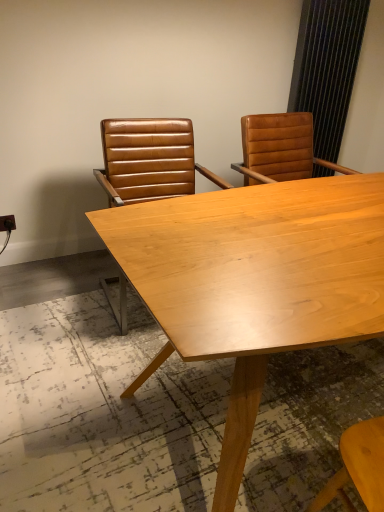
This screenshot has height=512, width=384. What do you see at coordinates (149, 160) in the screenshot? I see `brown leather chair at center, the 1th chair in the left-to-right sequence` at bounding box center [149, 160].

The height and width of the screenshot is (512, 384). Find the location of `brown leather chair at center, the 1th chair in the left-to-right sequence`. brown leather chair at center, the 1th chair in the left-to-right sequence is located at coordinates 149,160.

Which of these two, brown leather chair at center, the second chair when ordered from right to left, or brown leather chair at upper right, arranged as the second chair when viewed from the left, is bigger?

With larger size is brown leather chair at center, the second chair when ordered from right to left.

Is brown leather chair at center, the 1th chair in the left-to-right sequence, surrounding brown leather chair at upper right, arranged as the second chair when viewed from the left?

No, brown leather chair at upper right, arranged as the second chair when viewed from the left, is not surrounded by brown leather chair at center, the 1th chair in the left-to-right sequence.

Is brown leather chair at center, the second chair when ordered from right to left, turned away from brown leather chair at upper right, arranged as the second chair when viewed from the left?

brown leather chair at center, the second chair when ordered from right to left, does not have its back to brown leather chair at upper right, arranged as the second chair when viewed from the left.

I want to click on chair lying on the left of light wood table at center, so click(149, 160).

Is brown leather chair at center, the second chair when ordered from right to left, at the back of light wood table at center?

Yes, light wood table at center is facing away from brown leather chair at center, the second chair when ordered from right to left.

Considering the sizes of objects light wood table at center and brown leather chair at center, the 1th chair in the left-to-right sequence, in the image provided, who is smaller, light wood table at center or brown leather chair at center, the 1th chair in the left-to-right sequence,?

Smaller between the two is brown leather chair at center, the 1th chair in the left-to-right sequence.

Does light wood table at center have a lesser height compared to brown leather chair at center, the 1th chair in the left-to-right sequence?

Yes.

Are black textured curtain at upper right and brown leather chair at center, the second chair when ordered from right to left, located far from each other?

Yes, black textured curtain at upper right is far from brown leather chair at center, the second chair when ordered from right to left.

Which of these two, black textured curtain at upper right or brown leather chair at center, the 1th chair in the left-to-right sequence, is smaller?

With smaller size is black textured curtain at upper right.

Consider the image. Is black textured curtain at upper right thinner than brown leather chair at center, the 1th chair in the left-to-right sequence?

Yes, black textured curtain at upper right is thinner than brown leather chair at center, the 1th chair in the left-to-right sequence.

Is brown leather chair at center, the 1th chair in the left-to-right sequence, at the back of black textured curtain at upper right?

No.

From a real-world perspective, between light wood table at center and brown leather chair at upper right, which appears as the first chair when viewed from the right, who is vertically higher?

brown leather chair at upper right, which appears as the first chair when viewed from the right, from a real-world perspective.

Which of these two, light wood table at center or brown leather chair at upper right, arranged as the second chair when viewed from the left, stands taller?

light wood table at center is taller.

From the image's perspective, who appears lower, light wood table at center or brown leather chair at upper right, which appears as the first chair when viewed from the right?

light wood table at center is shown below in the image.

Can you confirm if light wood table at center is smaller than brown leather chair at upper right, arranged as the second chair when viewed from the left?

No, light wood table at center is not smaller than brown leather chair at upper right, arranged as the second chair when viewed from the left.

Does brown leather chair at upper right, which appears as the first chair when viewed from the right, have a lesser height compared to light wood table at center?

Yes, brown leather chair at upper right, which appears as the first chair when viewed from the right, is shorter than light wood table at center.

Consider the image. Which object is thinner, brown leather chair at upper right, which appears as the first chair when viewed from the right, or light wood table at center?

brown leather chair at upper right, which appears as the first chair when viewed from the right, is thinner.

Is black textured curtain at upper right inside the boundaries of brown leather chair at upper right, which appears as the first chair when viewed from the right, or outside?

black textured curtain at upper right is outside brown leather chair at upper right, which appears as the first chair when viewed from the right.

Is black textured curtain at upper right looking in the opposite direction of brown leather chair at upper right, arranged as the second chair when viewed from the left?

black textured curtain at upper right does not have its back to brown leather chair at upper right, arranged as the second chair when viewed from the left.

From the picture: Is black textured curtain at upper right next to brown leather chair at upper right, arranged as the second chair when viewed from the left, and touching it?

They are not placed beside each other.

From the image's perspective, is black textured curtain at upper right on brown leather chair at upper right, which appears as the first chair when viewed from the right?

Yes, from the image's perspective, black textured curtain at upper right is above brown leather chair at upper right, which appears as the first chair when viewed from the right.

Is brown leather chair at upper right, which appears as the first chair when viewed from the right, turned away from black textured curtain at upper right?

brown leather chair at upper right, which appears as the first chair when viewed from the right, is not turned away from black textured curtain at upper right.

Would you say brown leather chair at upper right, which appears as the first chair when viewed from the right, is inside or outside black textured curtain at upper right?

brown leather chair at upper right, which appears as the first chair when viewed from the right, is not enclosed by black textured curtain at upper right.

From a real-world perspective, which is physically above, brown leather chair at upper right, arranged as the second chair when viewed from the left, or black textured curtain at upper right?

black textured curtain at upper right is physically above.

Who is bigger, brown leather chair at upper right, which appears as the first chair when viewed from the right, or black textured curtain at upper right?

Bigger between the two is brown leather chair at upper right, which appears as the first chair when viewed from the right.

What are the coordinates of `chair on the right of brown leather chair at center, the second chair when ordered from right to left` in the screenshot? It's located at (280, 148).

Image resolution: width=384 pixels, height=512 pixels. Find the location of `chair that is the 1st one above the light wood table at center (from a real-world perspective)`. chair that is the 1st one above the light wood table at center (from a real-world perspective) is located at coordinates (149, 160).

When comparing their distances from black textured curtain at upper right, does brown leather chair at center, the 1th chair in the left-to-right sequence, or light wood table at center seem closer?

brown leather chair at center, the 1th chair in the left-to-right sequence.

When comparing their distances from brown leather chair at center, the second chair when ordered from right to left, does brown leather chair at upper right, arranged as the second chair when viewed from the left, or light wood table at center seem further?

Among the two, light wood table at center is located further to brown leather chair at center, the second chair when ordered from right to left.

Based on their spatial positions, is black textured curtain at upper right or brown leather chair at upper right, which appears as the first chair when viewed from the right, closer to light wood table at center?

Among the two, brown leather chair at upper right, which appears as the first chair when viewed from the right, is located nearer to light wood table at center.

Looking at the image, which one is located further to brown leather chair at upper right, which appears as the first chair when viewed from the right, black textured curtain at upper right or light wood table at center?

light wood table at center is positioned further to the anchor brown leather chair at upper right, which appears as the first chair when viewed from the right.

Looking at the image, which one is located further to black textured curtain at upper right, brown leather chair at upper right, which appears as the first chair when viewed from the right, or light wood table at center?

light wood table at center.

Estimate the real-world distances between objects in this image. Which object is further from brown leather chair at upper right, arranged as the second chair when viewed from the left, black textured curtain at upper right or brown leather chair at center, the second chair when ordered from right to left?

The object further to brown leather chair at upper right, arranged as the second chair when viewed from the left, is black textured curtain at upper right.

Based on their spatial positions, is light wood table at center or black textured curtain at upper right further from brown leather chair at upper right, arranged as the second chair when viewed from the left?

Among the two, light wood table at center is located further to brown leather chair at upper right, arranged as the second chair when viewed from the left.

Based on the photo, considering their positions, is brown leather chair at center, the 1th chair in the left-to-right sequence, positioned closer to light wood table at center than brown leather chair at upper right, arranged as the second chair when viewed from the left?

brown leather chair at upper right, arranged as the second chair when viewed from the left, is closer to light wood table at center.

What are the coordinates of `chair between brown leather chair at center, the 1th chair in the left-to-right sequence, and black textured curtain at upper right in the front-back direction` in the screenshot? It's located at (280, 148).

In order to click on chair between light wood table at center and brown leather chair at upper right, arranged as the second chair when viewed from the left, in the front-back direction in this screenshot , I will do `click(149, 160)`.